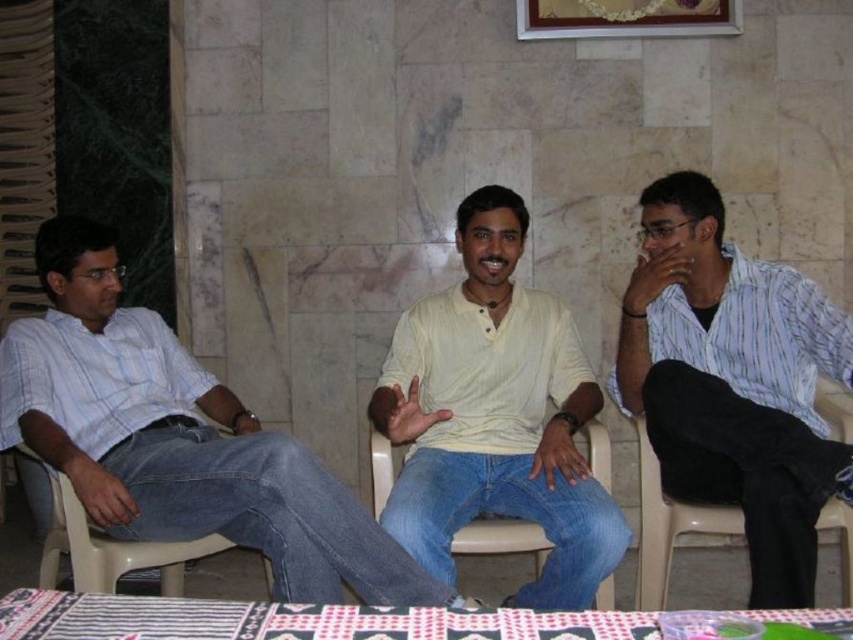
You are a furniture designer evaluating seating arrangements. You need to determine which chair between the white plastic chair at left and the plastic at right has a narrower frame for a more compact design. Which one would you choose?

The white plastic chair at left is thinner than the plastic at right, so you should choose the white plastic chair at left for a more compact design.

You are a guest at a party and want to place your drink on the table without spilling it. Which object should you choose between the light blue denim jeans at left and the patterned fabric table at lower center?

The patterned fabric table at lower center is behind light blue denim jeans at left, so you should place your drink on the patterned fabric table at lower center because it is a stable surface designed for placing items, while the light blue denim jeans at left are clothing and not suitable for placing drinks.